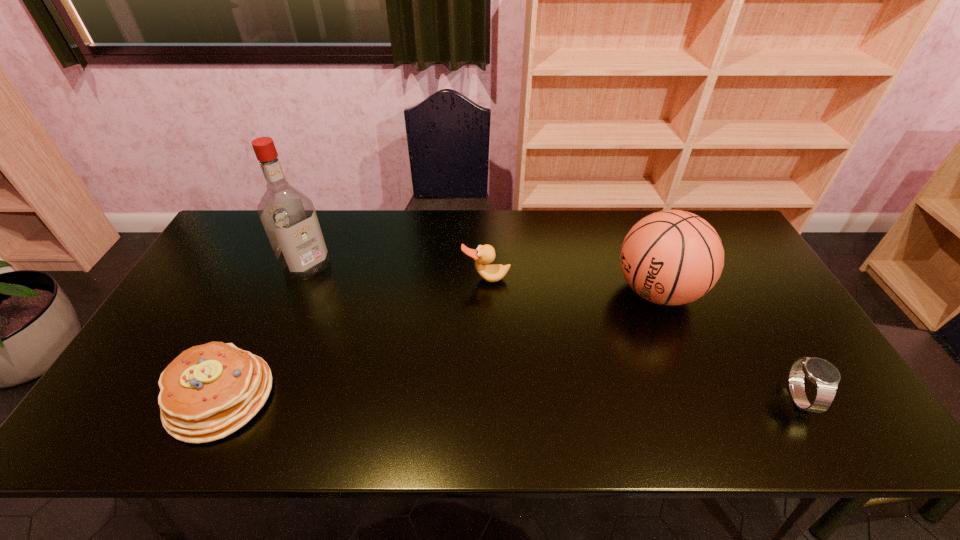
This screenshot has width=960, height=540. Find the location of `object situated at the left edge`. object situated at the left edge is located at coordinates (209, 391).

Image resolution: width=960 pixels, height=540 pixels. In order to click on object present at the right edge in this screenshot , I will do `click(825, 376)`.

The image size is (960, 540). What are the coordinates of `object located in the near left corner section of the desktop` in the screenshot? It's located at (209, 391).

At what (x,y) coordinates should I click in order to perform the action: click on object that is at the near right corner. Please return your answer as a coordinate pair (x, y). Looking at the image, I should click on (825, 376).

You are a GUI agent. You are given a task and a screenshot of the screen. Output one action in this format:
    pyautogui.click(x=<x>, y=<y>)
    Task: Click on the free point at the far edge
    Image resolution: width=960 pixels, height=540 pixels.
    Given the screenshot: What is the action you would take?
    pyautogui.click(x=414, y=234)

Identify the location of vacant space at the near edge of the desktop. (713, 399).

At what (x,y) coordinates should I click in order to perform the action: click on vacant space at the far right corner of the desktop. Please return your answer as a coordinate pair (x, y). The width and height of the screenshot is (960, 540). Looking at the image, I should click on (706, 218).

Identify the location of free area in between the rightmost object and the pancake. (510, 397).

Locate an element on the screen. This screenshot has height=540, width=960. unoccupied position between the watch and the tallest object is located at coordinates (552, 332).

Image resolution: width=960 pixels, height=540 pixels. I want to click on empty space that is in between the basketball and the rightmost object, so click(x=728, y=345).